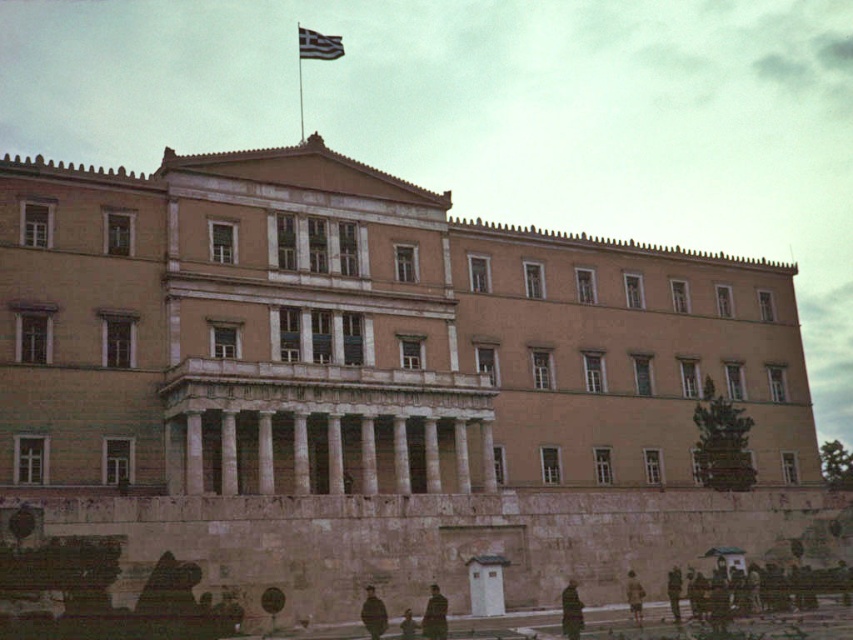
You are standing at the base of the grand neoclassical building and notice the white fabric flag at upper center and the metallic flag pole at upper center. How far apart are these two items from each other?

The white fabric flag at upper center is 26.05 feet away from the metallic flag pole at upper center.

You are an architect analyzing the symmetry of the grand neoclassical building. You notice a white fabric flag at upper center and a metallic flag pole at upper center. Which object has a smaller width?

The white fabric flag at upper center is thinner than the metallic flag pole at upper center, so the white fabric flag at upper center has a smaller width.